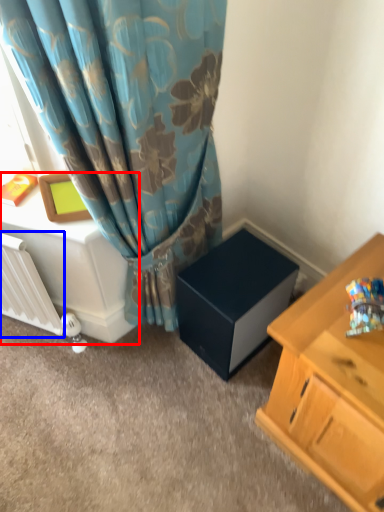
Question: Among these objects, which one is farthest to the camera, table (highlighted by a red box) or radiator (highlighted by a blue box)?

Choices:
 (A) table
 (B) radiator

Answer: (A)